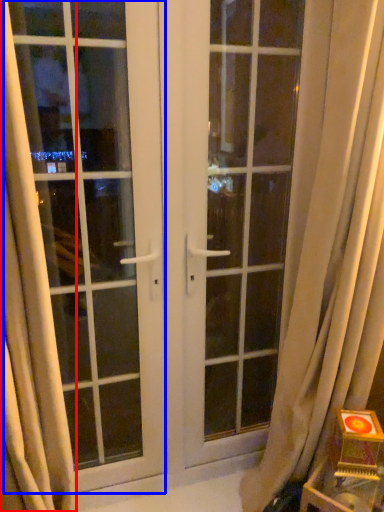
Question: Which object is closer to the camera taking this photo, curtain (highlighted by a red box) or window (highlighted by a blue box)?

Choices:
 (A) curtain
 (B) window

Answer: (A)